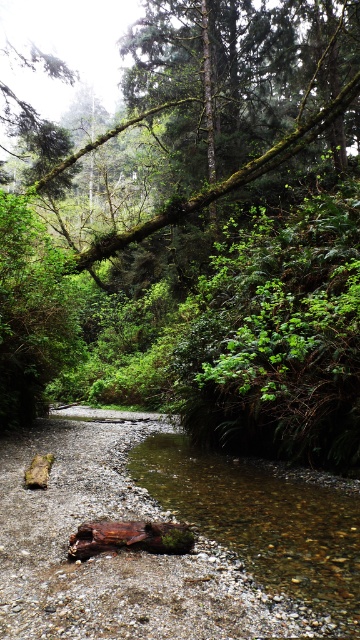
Who is positioned more to the left, green mossy branch at upper center or clear water at stream center?

green mossy branch at upper center

Does green mossy branch at upper center have a smaller size compared to clear water at stream center?

Incorrect, green mossy branch at upper center is not smaller in size than clear water at stream center.

Image resolution: width=360 pixels, height=640 pixels. I want to click on green mossy branch at upper center, so click(x=201, y=120).